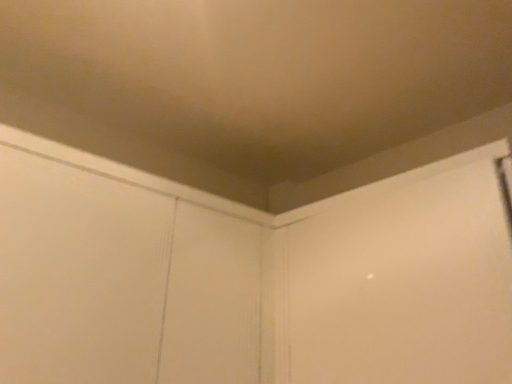
Question: In which direction should I rotate to look at white matte screen door at center, which is the second screen door from left to right?

Choices:
 (A) left
 (B) right

Answer: (B)

Question: Can you confirm if white matte screen door at center, which is counted as the first screen door, starting from the right, is wider than white wood screen door at upper center, placed as the second screen door when sorted from right to left?

Choices:
 (A) no
 (B) yes

Answer: (A)

Question: From the image's perspective, would you say white matte screen door at center, which is the second screen door from left to right, is positioned over white wood screen door at upper center, arranged as the first screen door when viewed from the left?

Choices:
 (A) yes
 (B) no

Answer: (A)

Question: Does white matte screen door at center, which is counted as the first screen door, starting from the right, have a larger size compared to white wood screen door at upper center, placed as the second screen door when sorted from right to left?

Choices:
 (A) yes
 (B) no

Answer: (B)

Question: Is white matte screen door at center, which is counted as the first screen door, starting from the right, shorter than white wood screen door at upper center, arranged as the first screen door when viewed from the left?

Choices:
 (A) no
 (B) yes

Answer: (B)

Question: Does white matte screen door at center, which is counted as the first screen door, starting from the right, come in front of white wood screen door at upper center, placed as the second screen door when sorted from right to left?

Choices:
 (A) yes
 (B) no

Answer: (B)

Question: Is white matte screen door at center, which is counted as the first screen door, starting from the right, completely or partially outside of white wood screen door at upper center, arranged as the first screen door when viewed from the left?

Choices:
 (A) no
 (B) yes

Answer: (B)

Question: Is white wood screen door at upper center, placed as the second screen door when sorted from right to left, far from white matte screen door at center, which is counted as the first screen door, starting from the right?

Choices:
 (A) yes
 (B) no

Answer: (B)

Question: Is the depth of white wood screen door at upper center, arranged as the first screen door when viewed from the left, greater than that of white matte screen door at center, which is the second screen door from left to right?

Choices:
 (A) yes
 (B) no

Answer: (B)

Question: Does white wood screen door at upper center, placed as the second screen door when sorted from right to left, have a greater width compared to white matte screen door at center, which is the second screen door from left to right?

Choices:
 (A) yes
 (B) no

Answer: (A)

Question: Is white wood screen door at upper center, arranged as the first screen door when viewed from the left, taller than white matte screen door at center, which is counted as the first screen door, starting from the right?

Choices:
 (A) no
 (B) yes

Answer: (B)

Question: Does white wood screen door at upper center, arranged as the first screen door when viewed from the left, appear on the left side of white matte screen door at center, which is counted as the first screen door, starting from the right?

Choices:
 (A) yes
 (B) no

Answer: (A)

Question: Can you confirm if white wood screen door at upper center, arranged as the first screen door when viewed from the left, is shorter than white matte screen door at center, which is counted as the first screen door, starting from the right?

Choices:
 (A) yes
 (B) no

Answer: (B)

Question: Considering the positions of white matte screen door at center, which is the second screen door from left to right, and white wood screen door at upper center, arranged as the first screen door when viewed from the left, in the image, is white matte screen door at center, which is the second screen door from left to right, wider or thinner than white wood screen door at upper center, arranged as the first screen door when viewed from the left,?

Choices:
 (A) wide
 (B) thin

Answer: (B)